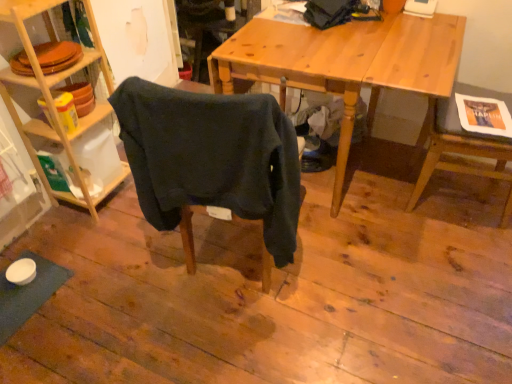
Identify the location of vacant space in front of woodenshelves at left. The width and height of the screenshot is (512, 384). (98, 231).